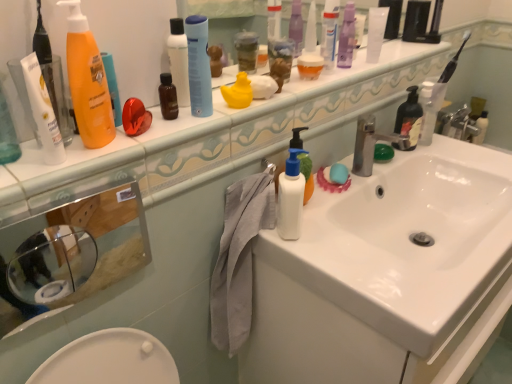
This screenshot has width=512, height=384. I want to click on free point to the right of matte white tube at upper left, which is counted as the first toiletry, starting from the front, so click(137, 151).